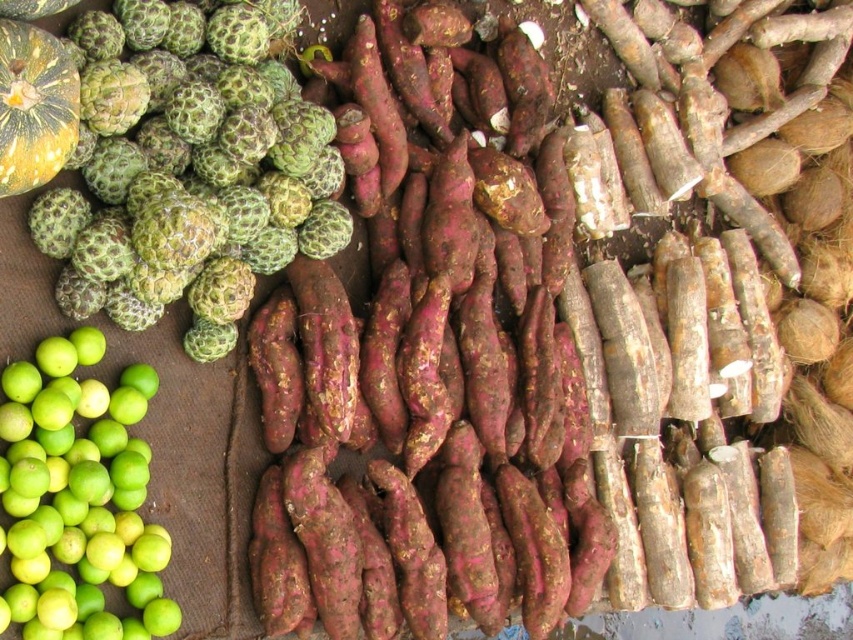
You are a customer at the market and want to pick up both the green rough textured fruit at upper left and the green matte lime at lower left. Which one is closer to your hand when you reach out?

The green rough textured fruit at upper left is closer to your hand because it is in front of the green matte lime at lower left.